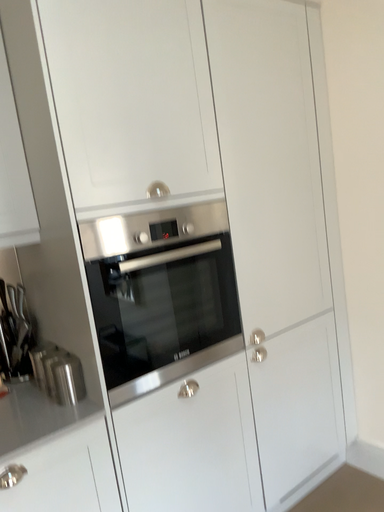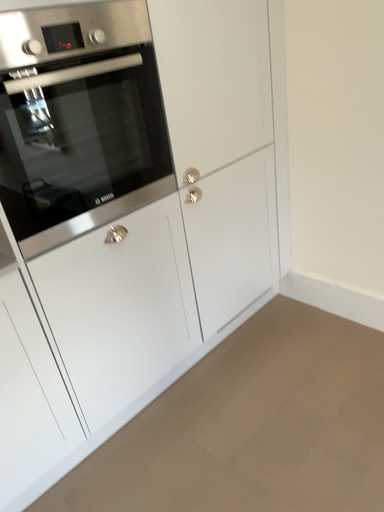
Question: Which way did the camera rotate in the video?

Choices:
 (A) rotated downward
 (B) rotated upward

Answer: (A)